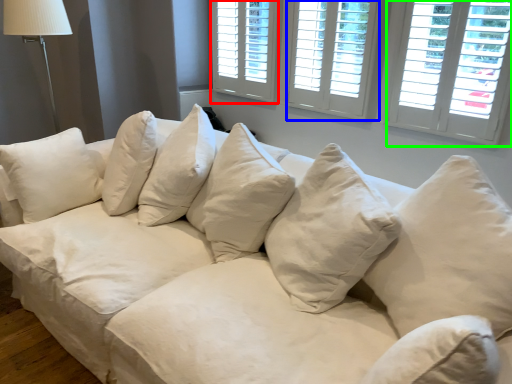
Question: Considering the real-world distances, which object is closest to window (highlighted by a red box)? window (highlighted by a blue box) or window (highlighted by a green box).

Choices:
 (A) window
 (B) window

Answer: (A)